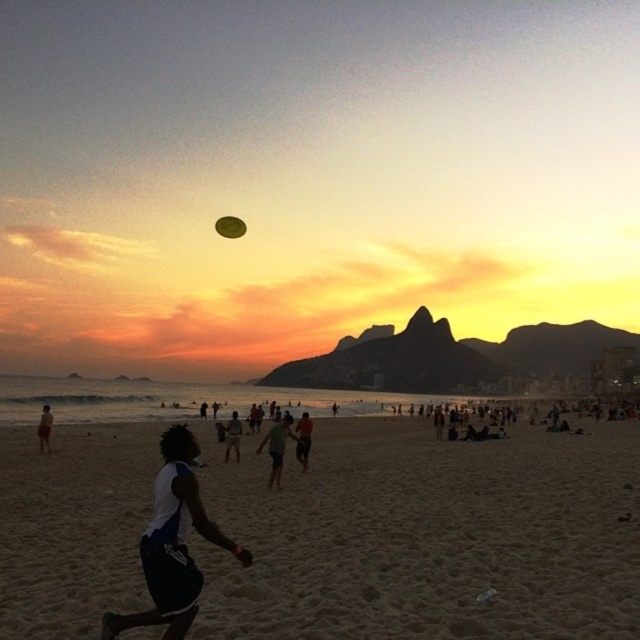
You are standing on the beach and see the white matte shorts at lower left and the light green fabric shirt at center. Which object is nearer to you?

The white matte shorts at lower left is closer to the viewer than the light green fabric shirt at center.

You are a photographer trying to capture a sunset shot. You see the sandy beach at center and the white matte shorts at lower left in your viewfinder. Based on their positions, which object would you adjust your camera angle to focus on first if you want to include both in the frame?

The sandy beach at center is positioned under the white matte shorts at lower left, so to include both in the frame, you should adjust your camera angle to focus on the sandy beach at center first as it is lower in the viewfinder.